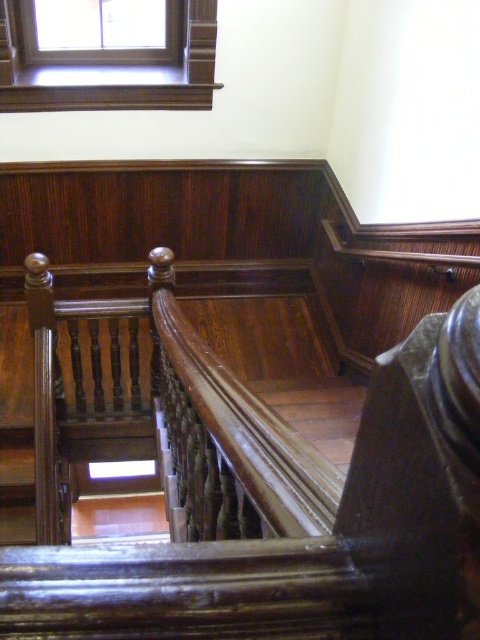
Who is positioned more to the right, glossy wood handrail at upper center or clear glass window at upper center?

glossy wood handrail at upper center is more to the right.

Which is in front, point (231, 490) or point (76, 24)?

Point (231, 490)

Consider the image. Who is more forward, (172,365) or (41,3)?

Point (172,365) is more forward.

Locate an element on the screen. glossy wood handrail at upper center is located at coordinates (262, 492).

Between wooden frame at upper left and clear glass window at upper center, which one has less height?

clear glass window at upper center

Is point (184, 26) behind point (179, 58)?

No.

Which is behind, point (199, 51) or point (76, 4)?

The point (76, 4) is more distant.

This screenshot has width=480, height=640. What are the coordinates of `wooden frame at upper left` in the screenshot? It's located at (110, 72).

Is glossy wood handrail at upper center above wooden frame at upper left?

Incorrect, glossy wood handrail at upper center is not positioned above wooden frame at upper left.

Which is below, glossy wood handrail at upper center or wooden frame at upper left?

glossy wood handrail at upper center is below.

The image size is (480, 640). In order to click on glossy wood handrail at upper center in this screenshot , I will do `click(262, 492)`.